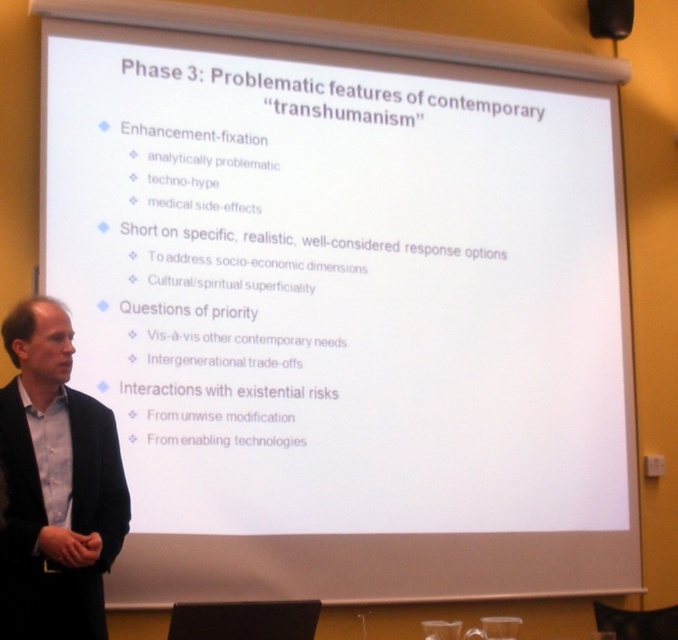
Between light blue shirt at left and black matte speaker at upper right, which one is positioned lower?

Positioned lower is light blue shirt at left.

Who is more forward, (35, 332) or (614, 38)?

Point (35, 332) is in front.

Locate an element on the screen. light blue shirt at left is located at coordinates (56, 484).